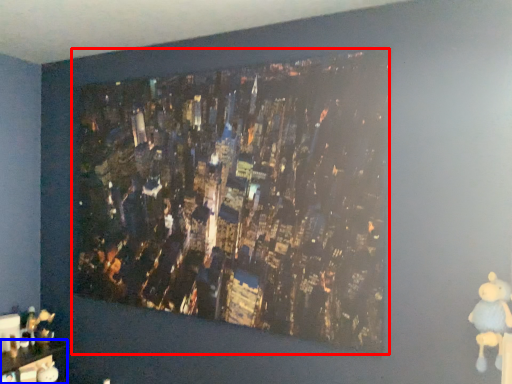
Question: Among these objects, which one is farthest to the camera, picture frame (highlighted by a red box) or furniture (highlighted by a blue box)?

Choices:
 (A) picture frame
 (B) furniture

Answer: (B)